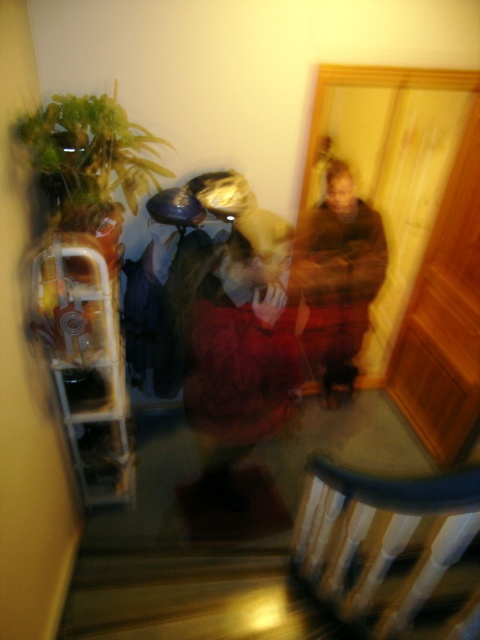
You are a fashion designer observing a model wearing both the velvet red dress at center and brown fuzzy sweater at center. You need to adjust the outfit to ensure there is at least 36 inches of space between the two garments for a more dramatic look. Is this adjustment possible given their current separation?

The velvet red dress at center and brown fuzzy sweater at center are currently 33.83 inches apart. Since 33.83 inches is less than the required 36 inches, the adjustment to increase the space between them to meet the 36 inches requirement is not possible without moving the garments further apart.

You are standing in the hallway and want to avoid tripping over the balustrade. Where should you place your feet to walk safely around the white painted wood balustrade at bottom located at point (389, 548)?

To avoid tripping over the white painted wood balustrade at bottom, you should place your feet away from the point (389, 548) where the balustrade is located.

You are a fashion stylist helping a client choose between the velvet red dress at center and the brown fuzzy sweater at center. Which item takes up more space visually?

The velvet red dress at center has a larger size compared to the brown fuzzy sweater at center, so it takes up more visual space.